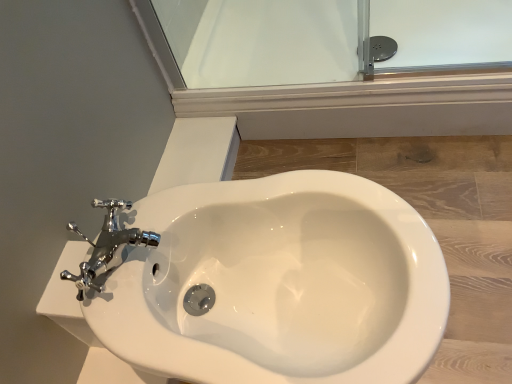
This screenshot has height=384, width=512. What do you see at coordinates (261, 41) in the screenshot? I see `transparent glass door at upper center` at bounding box center [261, 41].

Image resolution: width=512 pixels, height=384 pixels. I want to click on white glossy bidet at center, so click(278, 284).

Does chrome metallic faucet at upper left have a lesser width compared to transparent glass door at upper center?

Indeed, chrome metallic faucet at upper left has a lesser width compared to transparent glass door at upper center.

How far apart are chrome metallic faucet at upper left and transparent glass door at upper center?

A distance of 81.97 centimeters exists between chrome metallic faucet at upper left and transparent glass door at upper center.

From a real-world perspective, is chrome metallic faucet at upper left physically below transparent glass door at upper center?

No, from a real-world perspective, chrome metallic faucet at upper left is not below transparent glass door at upper center.

Where is `glass door above the chrome metallic faucet at upper left (from the image's perspective)`? The width and height of the screenshot is (512, 384). glass door above the chrome metallic faucet at upper left (from the image's perspective) is located at coordinates (261, 41).

From the picture: From the image's perspective, would you say chrome metallic faucet at upper left is shown under white glossy bidet at center?

Incorrect, from the image's perspective, chrome metallic faucet at upper left is higher than white glossy bidet at center.

From a real-world perspective, who is located higher, chrome metallic faucet at upper left or white glossy bidet at center?

From a 3D spatial view, chrome metallic faucet at upper left is above.

In the scene shown: Can you confirm if chrome metallic faucet at upper left is wider than white glossy bidet at center?

No.

Is chrome metallic faucet at upper left far from white glossy bidet at center?

chrome metallic faucet at upper left is actually quite close to white glossy bidet at center.

Based on the photo, between transparent glass door at upper center and white glossy bidet at center, which one appears on the right side from the viewer's perspective?

Positioned to the right is transparent glass door at upper center.

Is point (176, 54) behind point (157, 274)?

Yes, it is behind point (157, 274).

Can you tell me how much transparent glass door at upper center and white glossy bidet at center differ in facing direction?

They differ by 0.952 degrees in their facing directions.

From a real-world perspective, which is physically above, transparent glass door at upper center or white glossy bidet at center?

Answer: white glossy bidet at center is physically above.

Which point is more distant from viewer, [358,69] or [60,277]?

The point [358,69] is behind.

Does transparent glass door at upper center appear on the left side of chrome metallic faucet at upper left?

In fact, transparent glass door at upper center is to the right of chrome metallic faucet at upper left.

Consider the image. Considering their positions, is transparent glass door at upper center located in front of or behind chrome metallic faucet at upper left?

Clearly, transparent glass door at upper center is behind chrome metallic faucet at upper left.

Are white glossy bidet at center and transparent glass door at upper center beside each other?

white glossy bidet at center is not next to transparent glass door at upper center, and they're not touching.

Considering the positions of points (422, 233) and (498, 41), is point (422, 233) farther from camera compared to point (498, 41)?

No, it is not.

Does white glossy bidet at center appear on the left side of transparent glass door at upper center?

Indeed, white glossy bidet at center is positioned on the left side of transparent glass door at upper center.

Does white glossy bidet at center appear on the left side of chrome metallic faucet at upper left?

Incorrect, white glossy bidet at center is not on the left side of chrome metallic faucet at upper left.

Measure the distance between white glossy bidet at center and chrome metallic faucet at upper left.

white glossy bidet at center is 8.12 inches from chrome metallic faucet at upper left.

From a real-world perspective, is white glossy bidet at center located beneath chrome metallic faucet at upper left?

Yes.

Find the location of a particular element. The image size is (512, 384). tap in front of the transparent glass door at upper center is located at coordinates (106, 246).

In the image, there is a chrome metallic faucet at upper left. Identify the location of toilet below it (from a real-world perspective). (278, 284).

Consider the image. Which object lies further to the anchor point transparent glass door at upper center, white glossy bidet at center or chrome metallic faucet at upper left?

The object further to transparent glass door at upper center is chrome metallic faucet at upper left.

Based on their spatial positions, is white glossy bidet at center or transparent glass door at upper center further from chrome metallic faucet at upper left?

transparent glass door at upper center is positioned further to the anchor chrome metallic faucet at upper left.

Estimate the real-world distances between objects in this image. Which object is closer to white glossy bidet at center, chrome metallic faucet at upper left or transparent glass door at upper center?

The object closer to white glossy bidet at center is chrome metallic faucet at upper left.

Based on their spatial positions, is transparent glass door at upper center or white glossy bidet at center closer to chrome metallic faucet at upper left?

white glossy bidet at center lies closer to chrome metallic faucet at upper left than the other object.

Looking at this image, looking at the image, which one is located closer to white glossy bidet at center, transparent glass door at upper center or chrome metallic faucet at upper left?

The object closer to white glossy bidet at center is chrome metallic faucet at upper left.

From the image, which object appears to be nearer to transparent glass door at upper center, chrome metallic faucet at upper left or white glossy bidet at center?

white glossy bidet at center is closer to transparent glass door at upper center.

Locate an element on the screen. This screenshot has width=512, height=384. tap between transparent glass door at upper center and white glossy bidet at center in the vertical direction is located at coordinates (106, 246).